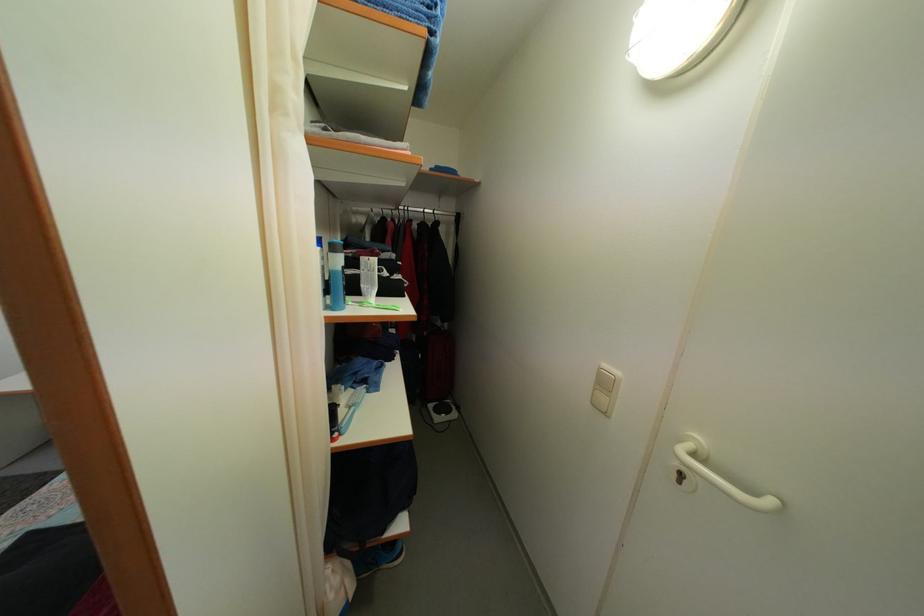
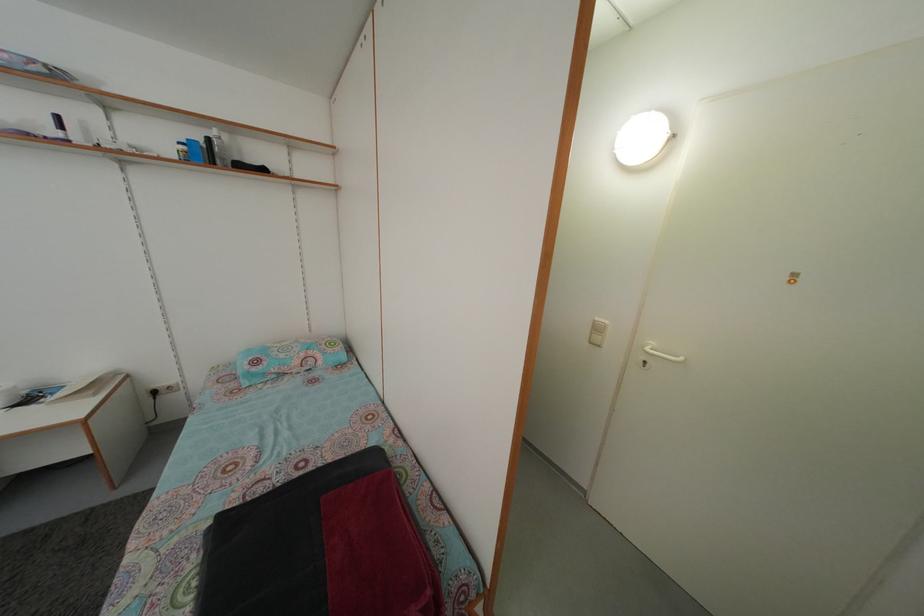
Find the pixel in the second image that matches (611,373) in the first image.

(602, 326)